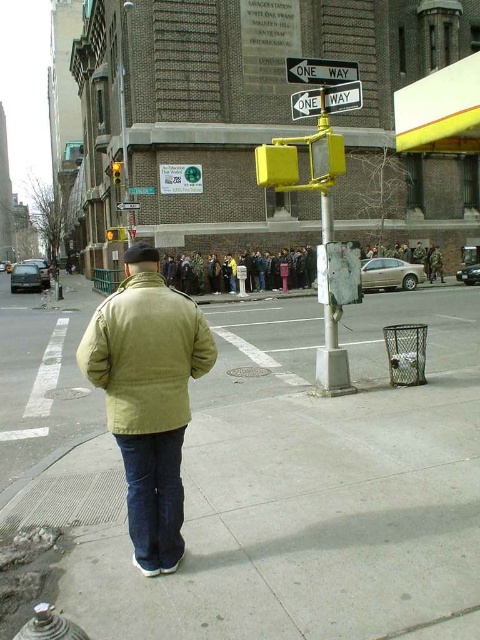
Question: Does metallic silver one-way sign at upper center lie in front of yellow plastic pole at center?

Choices:
 (A) yes
 (B) no

Answer: (A)

Question: Is black plastic one way sign at upper center smaller than yellow plastic traffic sign at upper center?

Choices:
 (A) no
 (B) yes

Answer: (B)

Question: Which point is closer to the camera?

Choices:
 (A) (118, 422)
 (B) (33, 339)
 (C) (130, 202)
 (D) (316, 83)

Answer: (A)

Question: Which object is closer to the camera taking this photo?

Choices:
 (A) metallic silver one-way sign at upper center
 (B) yellow plastic pole at center
 (C) yellow plastic traffic sign at upper center

Answer: (A)

Question: Is the position of smooth concrete sidewalk at center more distant than that of black plastic one way sign at upper center?

Choices:
 (A) yes
 (B) no

Answer: (B)

Question: Which point is farther to the camera?

Choices:
 (A) (335, 332)
 (B) (330, 70)

Answer: (A)